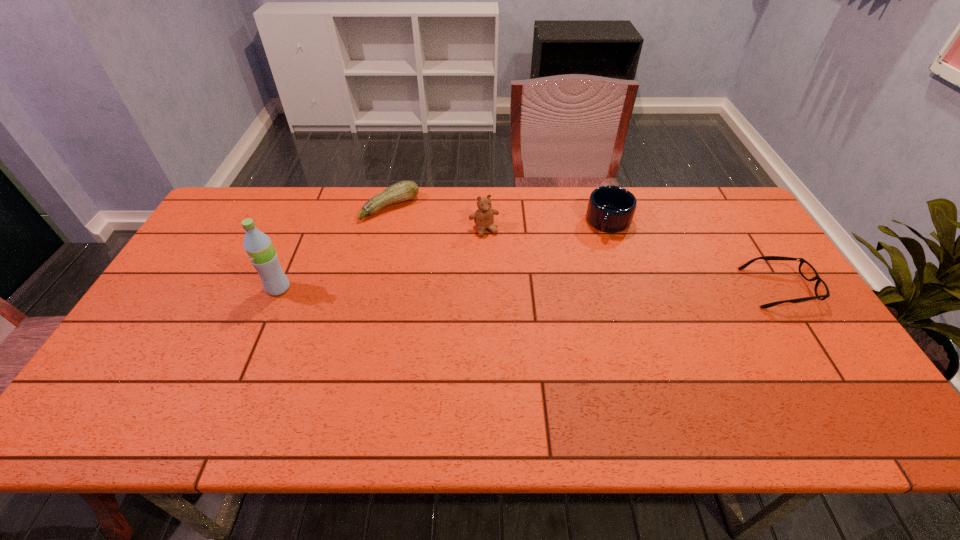
Where is `free space between the rightmost object and the leftmost object`? free space between the rightmost object and the leftmost object is located at coordinates (529, 288).

Locate an element on the screen. free point between the leftmost object and the spectacles is located at coordinates (529, 288).

Where is `vacant region between the shortest object and the second object from right to left`? This screenshot has height=540, width=960. vacant region between the shortest object and the second object from right to left is located at coordinates (694, 255).

Locate an element on the screen. The height and width of the screenshot is (540, 960). free space between the leftmost object and the mug is located at coordinates (444, 255).

Where is `free space that is in between the spectacles and the zucchini`? free space that is in between the spectacles and the zucchini is located at coordinates (x=586, y=248).

This screenshot has width=960, height=540. I want to click on free space that is in between the shortest object and the mug, so click(694, 255).

Locate an element on the screen. This screenshot has height=540, width=960. empty space between the fourth object from left to right and the zucchini is located at coordinates (499, 214).

Image resolution: width=960 pixels, height=540 pixels. I want to click on free spot between the third tallest object and the third object from right to left, so click(x=546, y=226).

Where is `the fourth closest object relative to the water bottle`? the fourth closest object relative to the water bottle is located at coordinates (807, 271).

The height and width of the screenshot is (540, 960). I want to click on object that is the third closest to the third shortest object, so click(406, 190).